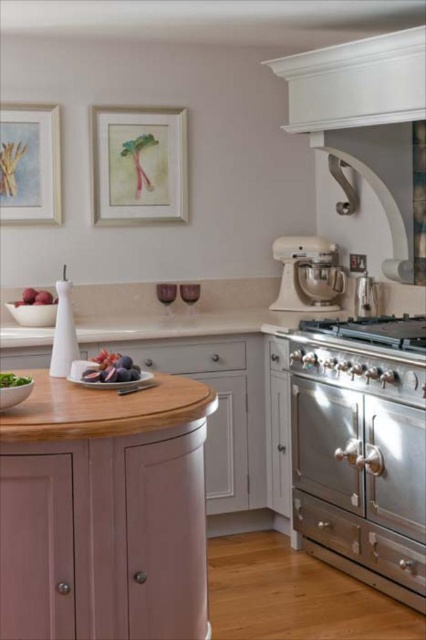
What do you see at coordinates (362, 548) in the screenshot? The width and height of the screenshot is (426, 640). I see `stainless steel drawer at lower right` at bounding box center [362, 548].

Which is in front, point (417, 573) or point (425, 348)?

Point (425, 348) is in front.

Locate an element on the screen. This screenshot has width=426, height=640. stainless steel drawer at lower right is located at coordinates (362, 548).

Where is `stainless steel drawer at lower right`? This screenshot has height=640, width=426. stainless steel drawer at lower right is located at coordinates (362, 548).

Between wooden table at center and purple matte grapes at center, which one appears on the left side from the viewer's perspective?

wooden table at center

Does wooden table at center have a greater width compared to purple matte grapes at center?

Correct, the width of wooden table at center exceeds that of purple matte grapes at center.

The height and width of the screenshot is (640, 426). What do you see at coordinates (103, 408) in the screenshot? I see `wooden table at center` at bounding box center [103, 408].

Identify the location of wooden table at center. (103, 408).

Can you confirm if stainless steel oven at right is smaller than matte white drawer at center?

Incorrect, stainless steel oven at right is not smaller in size than matte white drawer at center.

How far apart are stainless steel oven at right and matte white drawer at center?

33.53 inches

Identify the location of stainless steel oven at right. The image size is (426, 640). (360, 460).